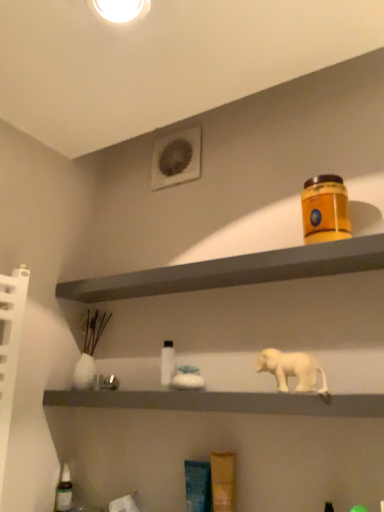
Question: Does matte orange container at upper right, the second shelf from the bottom, have a lesser height compared to white plastic air conditioning unit at upper center?

Choices:
 (A) no
 (B) yes

Answer: (B)

Question: Is matte orange container at upper right, the second shelf from the bottom, surrounding white plastic air conditioning unit at upper center?

Choices:
 (A) no
 (B) yes

Answer: (A)

Question: Can we say matte orange container at upper right, the second shelf from the bottom, lies outside white plastic air conditioning unit at upper center?

Choices:
 (A) yes
 (B) no

Answer: (A)

Question: Considering the relative positions of matte orange container at upper right, the second shelf from the bottom, and white plastic air conditioning unit at upper center in the image provided, is matte orange container at upper right, the second shelf from the bottom, behind white plastic air conditioning unit at upper center?

Choices:
 (A) yes
 (B) no

Answer: (B)

Question: Is the depth of matte orange container at upper right, which ranks as the first shelf in top-to-bottom order, less than that of white plastic air conditioning unit at upper center?

Choices:
 (A) no
 (B) yes

Answer: (B)

Question: Is orange matte jar at upper right taller or shorter than white plastic air conditioning unit at upper center?

Choices:
 (A) tall
 (B) short

Answer: (B)

Question: From the image's perspective, relative to white plastic air conditioning unit at upper center, is orange matte jar at upper right above or below?

Choices:
 (A) above
 (B) below

Answer: (B)

Question: Based on their positions, is orange matte jar at upper right located to the left or right of white plastic air conditioning unit at upper center?

Choices:
 (A) right
 (B) left

Answer: (A)

Question: In terms of width, does orange matte jar at upper right look wider or thinner when compared to white plastic air conditioning unit at upper center?

Choices:
 (A) wide
 (B) thin

Answer: (A)

Question: Is matte orange container at upper right, which ranks as the first shelf in top-to-bottom order, taller or shorter than white glossy bottle at center, marked as the 2th bottle in a left-to-right arrangement?

Choices:
 (A) short
 (B) tall

Answer: (A)

Question: From a real-world perspective, relative to white glossy bottle at center, the first bottle in the top-to-bottom sequence, is matte orange container at upper right, which ranks as the first shelf in top-to-bottom order, vertically above or below?

Choices:
 (A) above
 (B) below

Answer: (A)

Question: Considering the positions of matte orange container at upper right, the second shelf from the bottom, and white glossy bottle at center, placed as the first bottle when sorted from right to left, in the image, is matte orange container at upper right, the second shelf from the bottom, wider or thinner than white glossy bottle at center, placed as the first bottle when sorted from right to left,?

Choices:
 (A) wide
 (B) thin

Answer: (A)

Question: Is matte orange container at upper right, which ranks as the first shelf in top-to-bottom order, inside or outside of white glossy bottle at center, marked as the 2th bottle in a left-to-right arrangement?

Choices:
 (A) inside
 (B) outside

Answer: (B)

Question: Is point click(57, 510) positioned closer to the camera than point click(180, 169)?

Choices:
 (A) closer
 (B) farther

Answer: (A)

Question: Is translucent glass bottle at lower left, which appears as the second bottle when viewed from the right, inside or outside of white plastic air conditioning unit at upper center?

Choices:
 (A) inside
 (B) outside

Answer: (B)